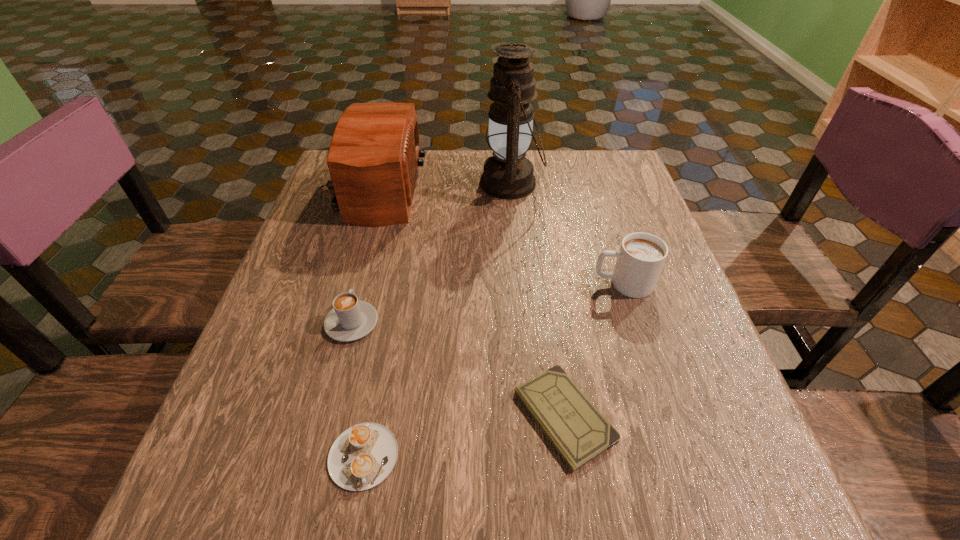
This screenshot has width=960, height=540. In order to click on radio receiver present at the far edge in this screenshot , I will do pos(373,160).

The width and height of the screenshot is (960, 540). I want to click on cappuccino located in the near edge section of the desktop, so click(x=362, y=456).

Where is `checkbook situated at the near edge`? checkbook situated at the near edge is located at coordinates (579, 432).

The image size is (960, 540). I want to click on radio receiver positioned at the left edge, so click(373, 160).

You are a GUI agent. You are given a task and a screenshot of the screen. Output one action in this format:
    pyautogui.click(x=<x>, y=<y>)
    Task: Click on the cappuccino present at the left edge
    
    Given the screenshot: What is the action you would take?
    pyautogui.click(x=350, y=319)

Where is `object that is positioned at the right edge`? The height and width of the screenshot is (540, 960). object that is positioned at the right edge is located at coordinates (640, 259).

At what (x,y) coordinates should I click in order to perform the action: click on object situated at the far left corner. Please return your answer as a coordinate pair (x, y). This screenshot has height=540, width=960. Looking at the image, I should click on (373, 160).

In the image, there is a desktop. At what (x,y) coordinates should I click in order to perform the action: click on free space at the far edge. Please return your answer as a coordinate pair (x, y). Looking at the image, I should click on (437, 158).

Identify the location of free space at the near edge of the desktop. (320, 470).

Locate an element on the screen. This screenshot has width=960, height=540. free space at the left edge of the desktop is located at coordinates (348, 256).